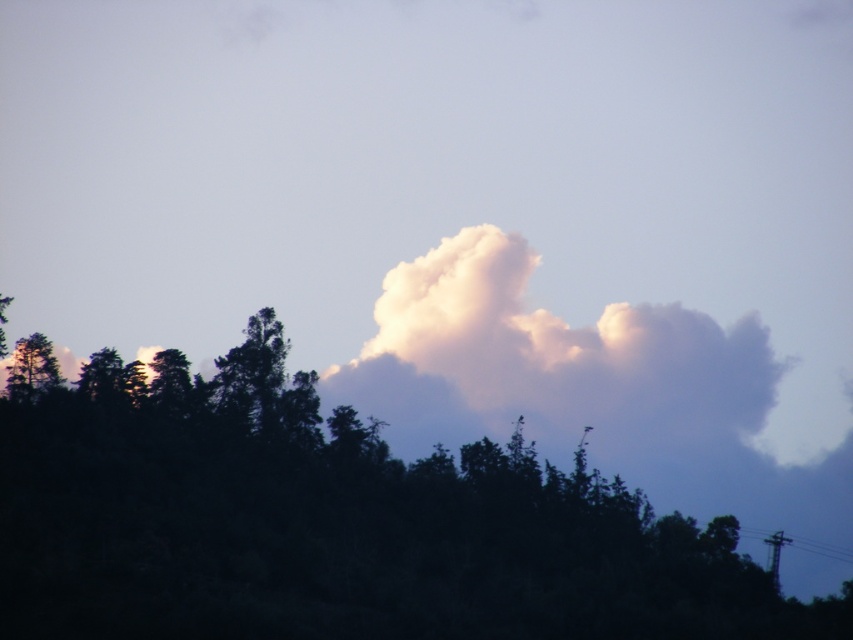
Between point (416, 564) and point (601, 317), which one is positioned behind?

Positioned behind is point (601, 317).

Who is more distant from viewer, (341, 465) or (454, 269)?

The point (454, 269) is more distant.

This screenshot has height=640, width=853. Find the location of `dark green foliage at upper center`. dark green foliage at upper center is located at coordinates (331, 522).